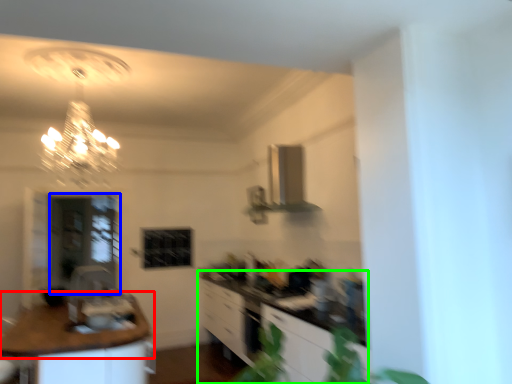
Question: Which is farther away from countertop (highlighted by a red box)? glass door (highlighted by a blue box) or cabinetry (highlighted by a green box)?

Choices:
 (A) glass door
 (B) cabinetry

Answer: (A)